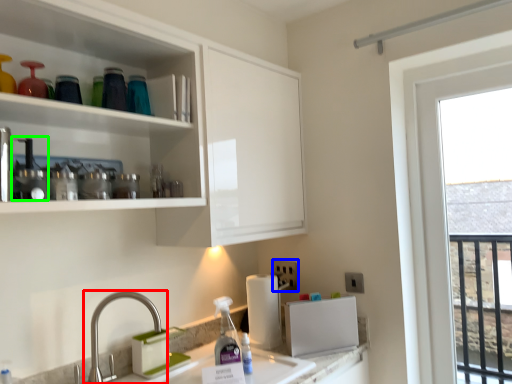
Question: Estimate the real-world distances between objects in this image. Which object is farther from tap (highlighted by a red box), electric outlet (highlighted by a blue box) or appliance (highlighted by a green box)?

Choices:
 (A) electric outlet
 (B) appliance

Answer: (A)